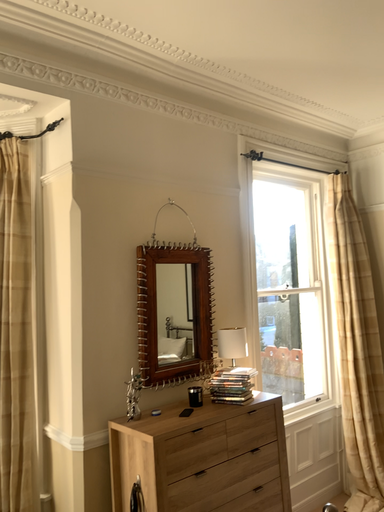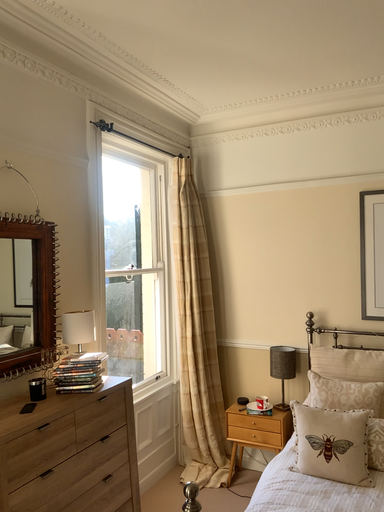
Question: How did the camera likely rotate when shooting the video?

Choices:
 (A) rotated left
 (B) rotated right

Answer: (B)